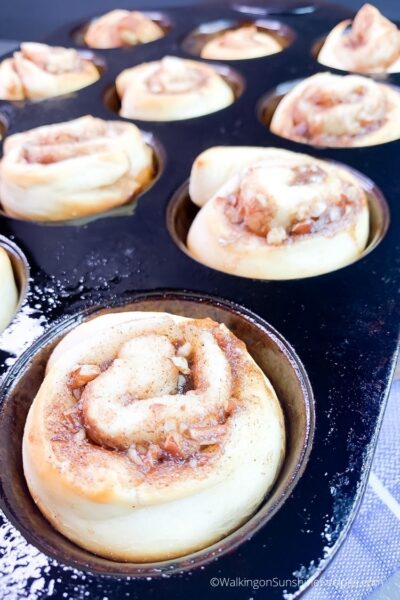
Locate an element on the screen. Image resolution: width=400 pixels, height=600 pixels. wall is located at coordinates (33, 8).